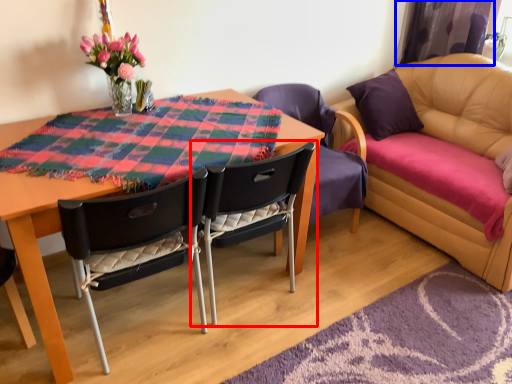
Question: Which object appears closest to the camera in this image, chair (highlighted by a red box) or curtain (highlighted by a blue box)?

Choices:
 (A) chair
 (B) curtain

Answer: (A)